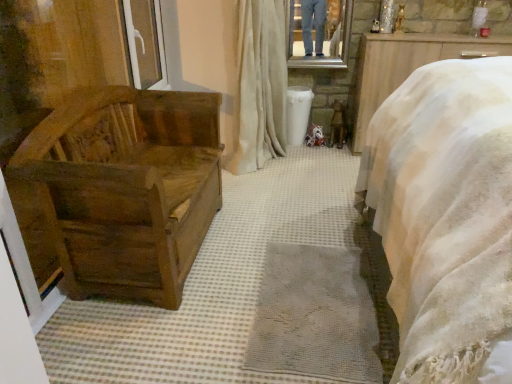
Question: Is satin beige curtain at center beside white plastic window at upper left?

Choices:
 (A) yes
 (B) no

Answer: (B)

Question: Is satin beige curtain at center closer to camera compared to white plastic window at upper left?

Choices:
 (A) no
 (B) yes

Answer: (A)

Question: From a real-world perspective, is satin beige curtain at center positioned under white plastic window at upper left based on gravity?

Choices:
 (A) no
 (B) yes

Answer: (B)

Question: Is satin beige curtain at center not within white plastic window at upper left?

Choices:
 (A) yes
 (B) no

Answer: (A)

Question: Can you confirm if satin beige curtain at center is wider than white plastic window at upper left?

Choices:
 (A) no
 (B) yes

Answer: (B)

Question: Choose the correct answer: Is white plastic window at upper left inside satin beige curtain at center or outside it?

Choices:
 (A) outside
 (B) inside

Answer: (A)

Question: Considering their positions, is white plastic window at upper left located in front of or behind satin beige curtain at center?

Choices:
 (A) behind
 (B) front

Answer: (B)

Question: From a real-world perspective, is white plastic window at upper left positioned above or below satin beige curtain at center?

Choices:
 (A) below
 (B) above

Answer: (B)

Question: Based on their positions, is white plastic window at upper left located to the left or right of satin beige curtain at center?

Choices:
 (A) right
 (B) left

Answer: (B)

Question: Based on their sizes in the image, would you say satin beige curtain at center is bigger or smaller than wooden chest at left?

Choices:
 (A) big
 (B) small

Answer: (B)

Question: Visually, is satin beige curtain at center positioned to the left or to the right of wooden chest at left?

Choices:
 (A) left
 (B) right

Answer: (B)

Question: From the image's perspective, is satin beige curtain at center located above or below wooden chest at left?

Choices:
 (A) above
 (B) below

Answer: (A)

Question: Would you say satin beige curtain at center is inside or outside wooden chest at left?

Choices:
 (A) inside
 (B) outside

Answer: (B)

Question: From the image's perspective, relative to white plastic window at upper left, is metallic reflective mirror at upper center above or below?

Choices:
 (A) above
 (B) below

Answer: (A)

Question: Is point (340, 39) closer or farther from the camera than point (144, 69)?

Choices:
 (A) farther
 (B) closer

Answer: (A)